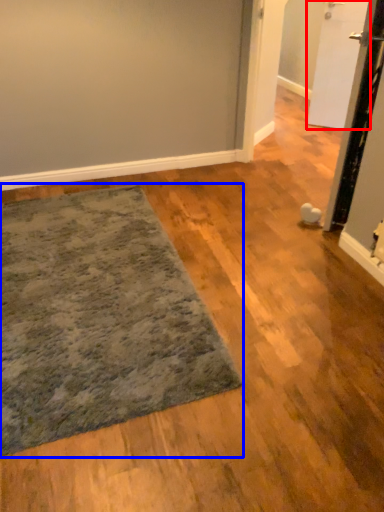
Question: Which of the following is the farthest to the observer, door (highlighted by a red box) or mat (highlighted by a blue box)?

Choices:
 (A) door
 (B) mat

Answer: (A)